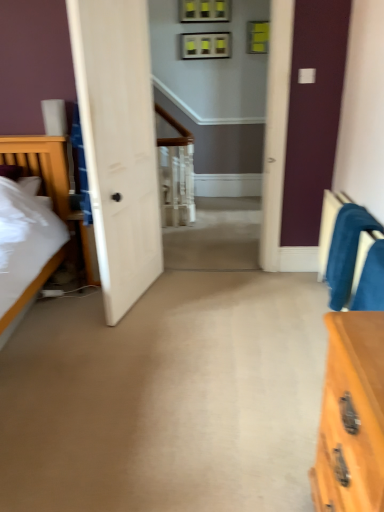
Question: Can you confirm if velvet blue armchair at right, which ranks as the 1th armchair in back-to-front order, is smaller than velvet blue armchair at right, arranged as the 2th armchair when viewed from the back?

Choices:
 (A) no
 (B) yes

Answer: (A)

Question: From a real-world perspective, is velvet blue armchair at right, the second armchair in the front-to-back sequence, on velvet blue armchair at right, the 1th armchair viewed from the front?

Choices:
 (A) no
 (B) yes

Answer: (A)

Question: From a real-world perspective, is velvet blue armchair at right, the second armchair in the front-to-back sequence, under velvet blue armchair at right, arranged as the 2th armchair when viewed from the back?

Choices:
 (A) no
 (B) yes

Answer: (B)

Question: Is velvet blue armchair at right, the 1th armchair viewed from the front, surrounded by velvet blue armchair at right, which ranks as the 1th armchair in back-to-front order?

Choices:
 (A) no
 (B) yes

Answer: (A)

Question: Considering the relative sizes of velvet blue armchair at right, which ranks as the 1th armchair in back-to-front order, and velvet blue armchair at right, the 1th armchair viewed from the front, in the image provided, is velvet blue armchair at right, which ranks as the 1th armchair in back-to-front order, shorter than velvet blue armchair at right, the 1th armchair viewed from the front,?

Choices:
 (A) no
 (B) yes

Answer: (A)

Question: Does velvet blue armchair at right, which ranks as the 1th armchair in back-to-front order, touch velvet blue armchair at right, the 1th armchair viewed from the front?

Choices:
 (A) no
 (B) yes

Answer: (A)

Question: From the image's perspective, would you say velvet blue armchair at right, arranged as the 2th armchair when viewed from the back, is shown under velvet blue armchair at right, which ranks as the 1th armchair in back-to-front order?

Choices:
 (A) no
 (B) yes

Answer: (B)

Question: Is velvet blue armchair at right, the second armchair in the front-to-back sequence, a part of velvet blue armchair at right, the 1th armchair viewed from the front?

Choices:
 (A) yes
 (B) no

Answer: (B)

Question: Is velvet blue armchair at right, arranged as the 2th armchair when viewed from the back, positioned in front of velvet blue armchair at right, which ranks as the 1th armchair in back-to-front order?

Choices:
 (A) yes
 (B) no

Answer: (A)

Question: Does velvet blue armchair at right, the 1th armchair viewed from the front, have a smaller size compared to velvet blue armchair at right, the second armchair in the front-to-back sequence?

Choices:
 (A) no
 (B) yes

Answer: (B)

Question: From a real-world perspective, does velvet blue armchair at right, the 1th armchair viewed from the front, sit lower than velvet blue armchair at right, which ranks as the 1th armchair in back-to-front order?

Choices:
 (A) yes
 (B) no

Answer: (B)

Question: Is velvet blue armchair at right, the 1th armchair viewed from the front, turned away from velvet blue armchair at right, the second armchair in the front-to-back sequence?

Choices:
 (A) no
 (B) yes

Answer: (A)

Question: Do you think velvet blue armchair at right, arranged as the 2th armchair when viewed from the back, is within velvet blue armchair at right, which ranks as the 1th armchair in back-to-front order, or outside of it?

Choices:
 (A) outside
 (B) inside

Answer: (A)